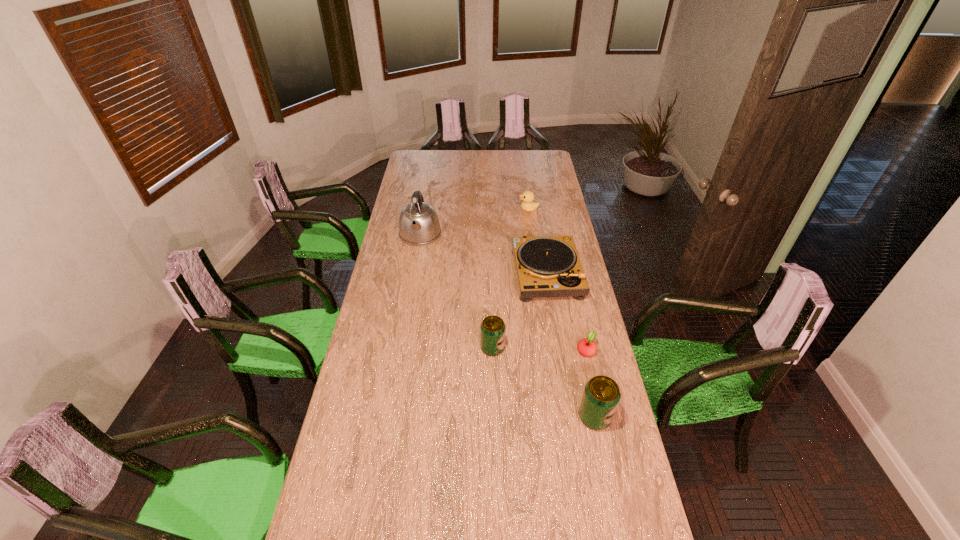
You are a GUI agent. You are given a task and a screenshot of the screen. Output one action in this format:
    pyautogui.click(x=<x>, y=<y>)
    Task: Click on the vacant area that lies between the leftmost object and the second tallest object
    
    Given the screenshot: What is the action you would take?
    pyautogui.click(x=508, y=326)

What are the coordinates of `vacant space that is in between the fifth object from right to left and the second tallest object` in the screenshot? It's located at (543, 382).

Locate an element on the screen. This screenshot has width=960, height=540. blank region between the shortest object and the left beer can is located at coordinates (539, 349).

Where is `free space that is in between the record player and the nearer beer can`? free space that is in between the record player and the nearer beer can is located at coordinates (570, 345).

This screenshot has width=960, height=540. Find the location of `free area in between the kettle and the farthest object`. free area in between the kettle and the farthest object is located at coordinates (474, 222).

In order to click on the fourth closest object to the fourth shortest object in this screenshot , I will do `click(419, 224)`.

The height and width of the screenshot is (540, 960). What are the coordinates of `object that ranks as the fourth closest to the shortest object` in the screenshot? It's located at (419, 224).

Identify the location of free space that satisfies the following two spatial constraints: 1. on the face of the farthest object; 2. on the right side of the taller beer can. The width and height of the screenshot is (960, 540). (559, 417).

You are a GUI agent. You are given a task and a screenshot of the screen. Output one action in this format:
    pyautogui.click(x=<x>, y=<y>)
    Task: Click on the vacant area that satisfies the following two spatial constraints: 1. on the back side of the shortest object; 2. on the right side of the nearest object
    
    Given the screenshot: What is the action you would take?
    pyautogui.click(x=581, y=350)

This screenshot has width=960, height=540. In order to click on blank area in the image that satisfies the following two spatial constraints: 1. on the spout of the tallest object; 2. on the left side of the record player in this screenshot , I will do `click(414, 273)`.